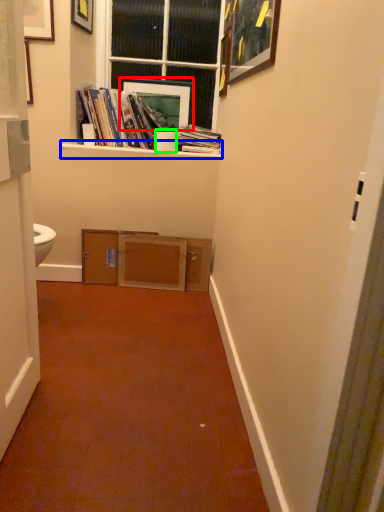
Question: Considering the real-world distances, which object is closest to picture frame (highlighted by a red box)? window sill (highlighted by a blue box) or toilet paper (highlighted by a green box).

Choices:
 (A) window sill
 (B) toilet paper

Answer: (B)